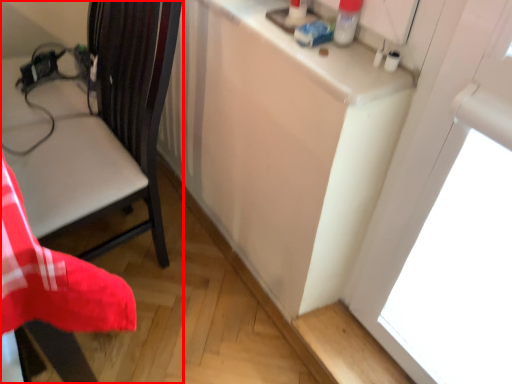
Question: From the image's perspective, what is the correct spatial relationship of chair (annotated by the red box) in relation to counter top?

Choices:
 (A) above
 (B) below

Answer: (B)